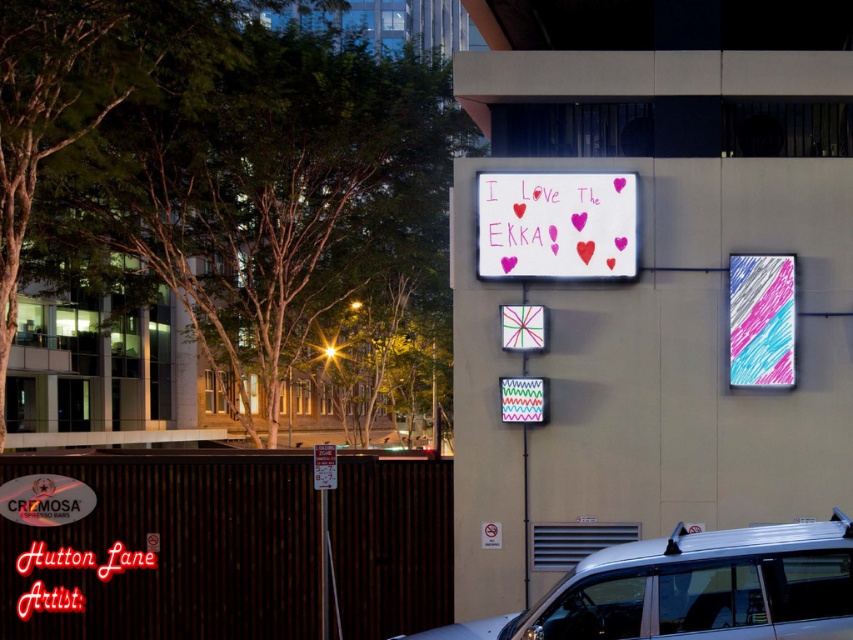
Consider the image. Between silver metallic van at lower right and pastel scribbled sign at upper right, which one is positioned higher?

Positioned higher is pastel scribbled sign at upper right.

Can you confirm if silver metallic van at lower right is thinner than pastel scribbled sign at upper right?

No, silver metallic van at lower right is not thinner than pastel scribbled sign at upper right.

Which is behind, point (672, 534) or point (780, 368)?

Positioned behind is point (780, 368).

Identify the location of silver metallic van at lower right. (694, 589).

Can you confirm if multicolored fabric sign at center is positioned to the right of white glossy sign at upper center?

Yes, multicolored fabric sign at center is to the right of white glossy sign at upper center.

Find the location of a particular element. multicolored fabric sign at center is located at coordinates (x=523, y=400).

Is silver metallic van at lower right wider than white glossy sign at upper center?

Yes, silver metallic van at lower right is wider than white glossy sign at upper center.

Between point (747, 545) and point (334, 476), which one is positioned in front?

Point (747, 545) is more forward.

This screenshot has height=640, width=853. In order to click on silver metallic van at lower right in this screenshot , I will do click(694, 589).